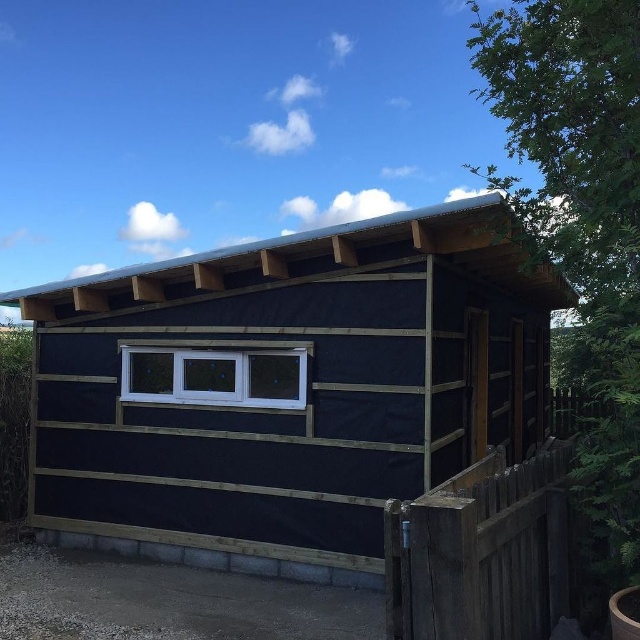
Looking at this image, can you confirm if black wood hut at center is thinner than white plastic window at center?

Yes.

Can you confirm if black wood hut at center is positioned below white plastic window at center?

No.

Which is in front, point (61, 356) or point (211, 368)?

Point (211, 368)

Where is `black wood hut at center`? The width and height of the screenshot is (640, 640). black wood hut at center is located at coordinates (285, 385).

Is weathered wood fence at right bigger than white plastic window at center?

Yes.

Between point (561, 525) and point (250, 380), which one is positioned in front?

Point (561, 525) is in front.

Find the location of `weathered wood fence at right`. weathered wood fence at right is located at coordinates (483, 552).

Is black wood hut at center to the left of weathered wood fence at right from the viewer's perspective?

Yes, black wood hut at center is to the left of weathered wood fence at right.

Does black wood hut at center appear under weathered wood fence at right?

No.

Who is more distant from viewer, (380, 230) or (524, 580)?

The point (380, 230) is more distant.

Find the location of `black wood hut at center`. black wood hut at center is located at coordinates [285, 385].